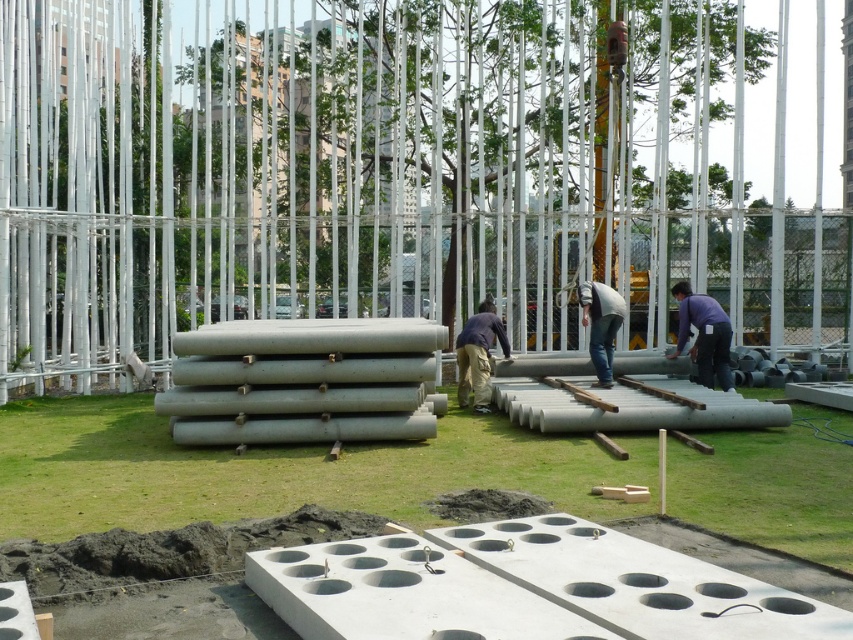
Who is lower down, green grass at center or purple matte shirt at center?

green grass at center is lower down.

What do you see at coordinates (276, 468) in the screenshot? I see `green grass at center` at bounding box center [276, 468].

Locate an element on the screen. green grass at center is located at coordinates (276, 468).

Is point (445, 556) positioned behind point (697, 324)?

No, it is not.

Is gray concrete at center smaller than purple matte shirt at center?

Actually, gray concrete at center might be larger than purple matte shirt at center.

Who is more distant from viewer, (413, 605) or (706, 349)?

The point (706, 349) is behind.

You are a GUI agent. You are given a task and a screenshot of the screen. Output one action in this format:
    pyautogui.click(x=<x>, y=<y>)
    Task: Click on the gray concrete at center
    This screenshot has width=853, height=640.
    Given the screenshot: What is the action you would take?
    tap(525, 588)

Which of these two, gray concrete at center or dark blue shirt at center, stands taller?

Standing taller between the two is dark blue shirt at center.

What do you see at coordinates (525, 588) in the screenshot? This screenshot has height=640, width=853. I see `gray concrete at center` at bounding box center [525, 588].

Locate an element on the screen. gray concrete at center is located at coordinates (525, 588).